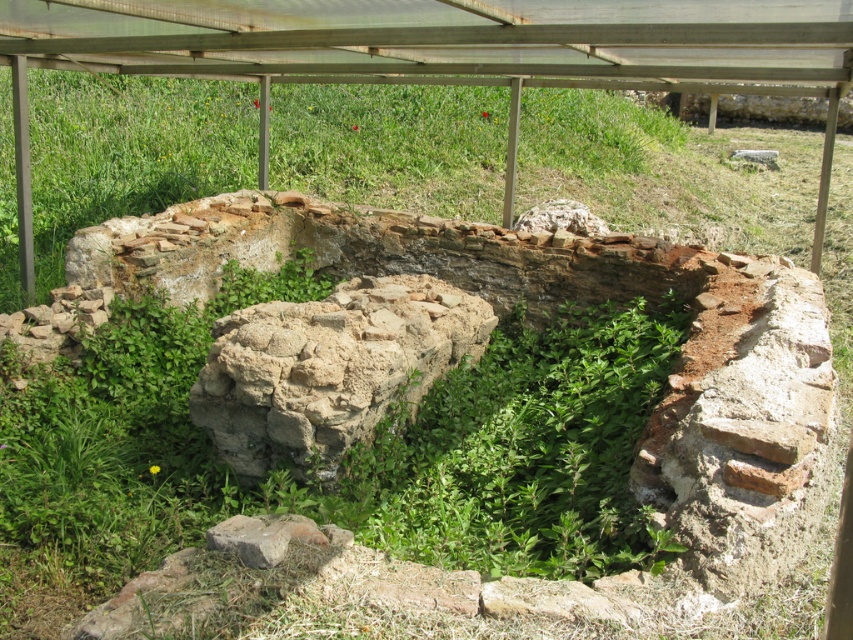
You are an archaeologist examining the ancient structure. You need to place a marker at the exact center of the structure. According to the coordinates provided, where should you place the marker relative to the brown rough stone at center?

The brown rough stone at center is located at point (329, 368), so you should place the marker at the coordinates (329, 368) relative to the brown rough stone at center as it is already at the center of the structure.

You are an archaeologist examining the ancient structure. You notice the green leafy weed at center and the brown rough stone at center. Which object is positioned lower in the scene?

The green leafy weed at center is positioned below the brown rough stone at center, so it is lower in the scene.